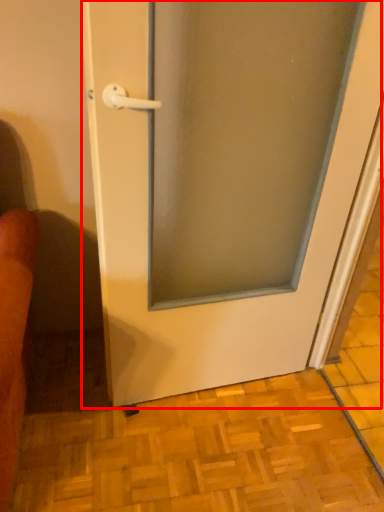
Question: Considering the relative positions of door (annotated by the red box) and tile in the image provided, where is door (annotated by the red box) located with respect to the staircase?

Choices:
 (A) right
 (B) left

Answer: (A)